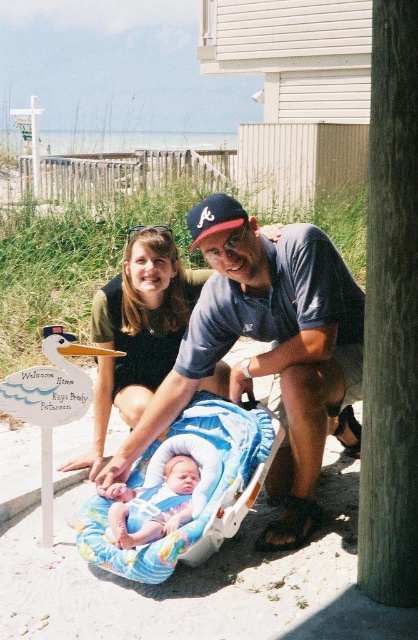
You need to choose between the blue fabric baby carrier at center and the blue fabric baseball cap at center to pack for a trip. Which one takes up more space?

The blue fabric baby carrier at center is larger in size than the blue fabric baseball cap at center, so it takes up more space.

You are a photographer at the beach scene and need to choose between the blue fabric baby carrier at center and the blue fabric baby carriage at center to include in your shot. Which one should you choose if you want to highlight a larger object in the image?

The blue fabric baby carrier at center is larger in size than the blue fabric baby carriage at center, so you should choose the blue fabric baby carrier at center to highlight a larger object in the image.